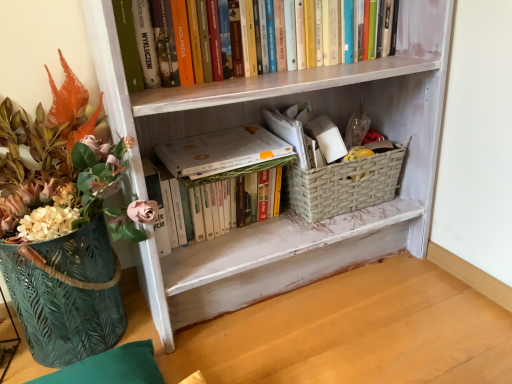
This screenshot has height=384, width=512. What do you see at coordinates (344, 185) in the screenshot?
I see `woven beige basket at lower center` at bounding box center [344, 185].

The width and height of the screenshot is (512, 384). What do you see at coordinates (221, 151) in the screenshot? I see `white matte book at center` at bounding box center [221, 151].

Measure the distance between white matte book at center and camera.

1.05 meters.

Describe the element at coordinates (288, 214) in the screenshot. This screenshot has height=384, width=512. I see `white painted wood bookcase at center` at that location.

Locate an element on the screen. The image size is (512, 384). hardcover books at upper center, the 2th book positioned from the bottom is located at coordinates (128, 45).

How much space does hardcover books at upper center, which ranks as the first book in top-to-bottom order, occupy vertically?

7.95 inches.

Identify the location of green textured basket at left. (62, 225).

Is woven beige basket at lower center next to green textured basket at left and touching it?

No, woven beige basket at lower center is not making contact with green textured basket at left.

Is woven beige basket at lower center looking in the opposite direction of green textured basket at left?

That's not correct — woven beige basket at lower center is not looking away from green textured basket at left.

Is point (319, 202) positioned behind point (76, 109)?

Yes, point (319, 202) is farther from viewer.

From the image's perspective, is woven beige basket at lower center located above or below green textured basket at left?

Clearly, from the image's perspective, woven beige basket at lower center is above green textured basket at left.

Looking at this image, from the image's perspective, which one is positioned lower, white matte book at center or green textured basket at left?

green textured basket at left appears lower in the image.

The image size is (512, 384). I want to click on houseplant below the white matte book at center (from the image's perspective), so click(62, 225).

Based on the photo, could you tell me if white matte book at center, which is the 1th book in bottom-to-top order, is turned towards white painted wood bookcase at center?

Yes, white matte book at center, which is the 1th book in bottom-to-top order, faces towards white painted wood bookcase at center.

In the image, is white matte book at center, positioned as the second book in top-to-bottom order, on the left side or the right side of white painted wood bookcase at center?

In the image, white matte book at center, positioned as the second book in top-to-bottom order, appears on the left side of white painted wood bookcase at center.

From a real-world perspective, relative to white painted wood bookcase at center, is white matte book at center, which is the 1th book in bottom-to-top order, vertically above or below?

white matte book at center, which is the 1th book in bottom-to-top order, is situated lower than white painted wood bookcase at center in the real world.

Are white matte book at center, which is the 1th book in bottom-to-top order, and white painted wood bookcase at center making contact?

white matte book at center, which is the 1th book in bottom-to-top order, is not next to white painted wood bookcase at center, and they're not touching.

Consider the image. How different are the orientations of hardcover books at upper center, which ranks as the first book in top-to-bottom order, and woven beige basket at lower center in degrees?

The angular difference between hardcover books at upper center, which ranks as the first book in top-to-bottom order, and woven beige basket at lower center is 1.73 degrees.

Considering the sizes of hardcover books at upper center, which ranks as the first book in top-to-bottom order, and woven beige basket at lower center in the image, is hardcover books at upper center, which ranks as the first book in top-to-bottom order, taller or shorter than woven beige basket at lower center?

Clearly, hardcover books at upper center, which ranks as the first book in top-to-bottom order, is taller compared to woven beige basket at lower center.

Which of these two, hardcover books at upper center, the 2th book positioned from the bottom, or woven beige basket at lower center, is bigger?

Bigger between the two is hardcover books at upper center, the 2th book positioned from the bottom.

Considering the positions of point (139, 86) and point (364, 181), is point (139, 86) closer or farther from the camera than point (364, 181)?

Point (139, 86) is closer to the camera than point (364, 181).

Does point (173, 305) lie behind point (35, 224)?

That is True.

In the image, is white painted wood bookcase at center positioned in front of or behind green textured basket at left?

Clearly, white painted wood bookcase at center is behind green textured basket at left.

Which is more to the left, white painted wood bookcase at center or green textured basket at left?

From the viewer's perspective, green textured basket at left appears more on the left side.

Which object is closer to the camera, woven beige basket at lower center or white matte book at center, which is the 1th book in bottom-to-top order?

white matte book at center, which is the 1th book in bottom-to-top order, is closer to the camera.

Is woven beige basket at lower center oriented away from white matte book at center, positioned as the second book in top-to-bottom order?

No, woven beige basket at lower center is not facing away from white matte book at center, positioned as the second book in top-to-bottom order.

Does woven beige basket at lower center appear on the left side of white matte book at center, which is the 1th book in bottom-to-top order?

Incorrect, woven beige basket at lower center is not on the left side of white matte book at center, which is the 1th book in bottom-to-top order.

From the image's perspective, is woven beige basket at lower center beneath white matte book at center, positioned as the second book in top-to-bottom order?

Actually, woven beige basket at lower center appears above white matte book at center, positioned as the second book in top-to-bottom order, in the image.

Is point (200, 154) behind point (226, 142)?

That is False.

Is white matte book at center aimed at white matte book at center, which is the 1th book in bottom-to-top order?

Yes, white matte book at center is turned towards white matte book at center, which is the 1th book in bottom-to-top order.

Can you confirm if white matte book at center is positioned to the right of white matte book at center, positioned as the second book in top-to-bottom order?

Correct, you'll find white matte book at center to the right of white matte book at center, positioned as the second book in top-to-bottom order.

How different are the orientations of white matte book at center and white matte book at center, which is the 1th book in bottom-to-top order, in degrees?

white matte book at center and white matte book at center, which is the 1th book in bottom-to-top order, are facing 1.8 degrees away from each other.

In order to click on houseplant below the woven beige basket at lower center (from the image's perspective) in this screenshot , I will do `click(62, 225)`.

What are the coordinates of `paperback book that is above the green textured basket at left (from the image's perspective)` in the screenshot? It's located at (221, 151).

Estimate the real-world distances between objects in this image. Which object is further from white painted wood bookcase at center, woven beige basket at lower center or hardcover books at upper center, which ranks as the first book in top-to-bottom order?

Among the two, hardcover books at upper center, which ranks as the first book in top-to-bottom order, is located further to white painted wood bookcase at center.

Considering their positions, is green textured basket at left positioned further to white matte book at center than white painted wood bookcase at center?

Among the two, green textured basket at left is located further to white matte book at center.

Which object lies nearer to the anchor point white painted wood bookcase at center, woven beige basket at lower center or white matte book at center, positioned as the second book in top-to-bottom order?

Among the two, woven beige basket at lower center is located nearer to white painted wood bookcase at center.

Looking at the image, which one is located closer to white matte book at center, woven beige basket at lower center or white matte book at center, positioned as the second book in top-to-bottom order?

Among the two, white matte book at center, positioned as the second book in top-to-bottom order, is located nearer to white matte book at center.

When comparing their distances from white matte book at center, positioned as the second book in top-to-bottom order, does woven beige basket at lower center or white painted wood bookcase at center seem closer?

white painted wood bookcase at center is positioned closer to the anchor white matte book at center, positioned as the second book in top-to-bottom order.

From the image, which object appears to be farther from hardcover books at upper center, which ranks as the first book in top-to-bottom order, white matte book at center, which is the 1th book in bottom-to-top order, or woven beige basket at lower center?

woven beige basket at lower center is further to hardcover books at upper center, which ranks as the first book in top-to-bottom order.

Which object lies further to the anchor point hardcover books at upper center, which ranks as the first book in top-to-bottom order, white matte book at center or green textured basket at left?

Based on the image, green textured basket at left appears to be further to hardcover books at upper center, which ranks as the first book in top-to-bottom order.

Considering their positions, is white matte book at center, positioned as the second book in top-to-bottom order, positioned closer to green textured basket at left than white painted wood bookcase at center?

white matte book at center, positioned as the second book in top-to-bottom order, lies closer to green textured basket at left than the other object.

You are a GUI agent. You are given a task and a screenshot of the screen. Output one action in this format:
    pyautogui.click(x=<x>, y=<y>)
    Task: Click on the bookcase between hardcover books at upper center, which ranks as the first book in top-to-bottom order, and white matte book at center, in the vertical direction
    
    Given the screenshot: What is the action you would take?
    pyautogui.click(x=288, y=214)

Identify the location of paperback book between hardcover books at upper center, which ranks as the first book in top-to-bottom order, and woven beige basket at lower center, in the vertical direction. (221, 151).

This screenshot has height=384, width=512. I want to click on paperback book between white painted wood bookcase at center and woven beige basket at lower center from front to back, so click(221, 151).

This screenshot has height=384, width=512. I want to click on paperback book situated between green textured basket at left and woven beige basket at lower center from left to right, so click(221, 151).